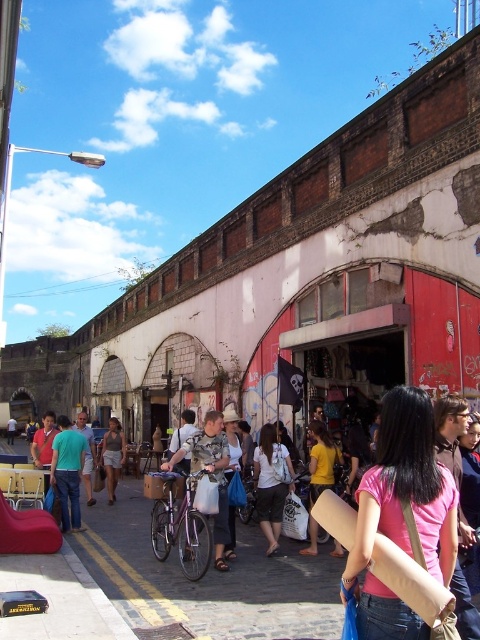
You are a photographer standing on the cobblestone street in the scene. You notice two people wearing a pink matte shirt at center and a matte green shirt at center. Which person would appear larger in your photo if you focus on them both equally?

The pink matte shirt at center is taller than the matte green shirt at center, so the person wearing the pink matte shirt at center would appear larger in the photo.

You are a photographer standing on the cobblestone street and want to take a photo of the matte green shirt at center and the light gray cotton shirt at center. Which shirt will appear closer to the camera in the photo?

The matte green shirt at center will appear closer to the camera because it is in front of the light gray cotton shirt at center.